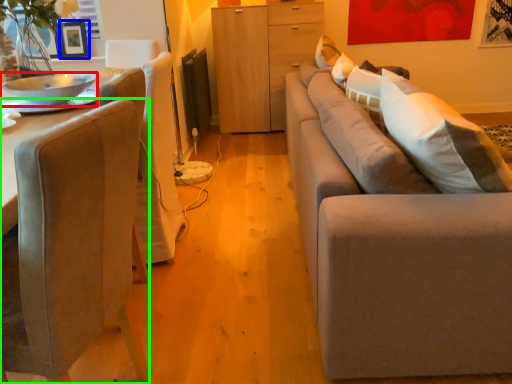
Question: Which object is the farthest from bowl (highlighted by a red box)? Choose among these: picture frame (highlighted by a blue box) or chair (highlighted by a green box).

Choices:
 (A) picture frame
 (B) chair

Answer: (A)